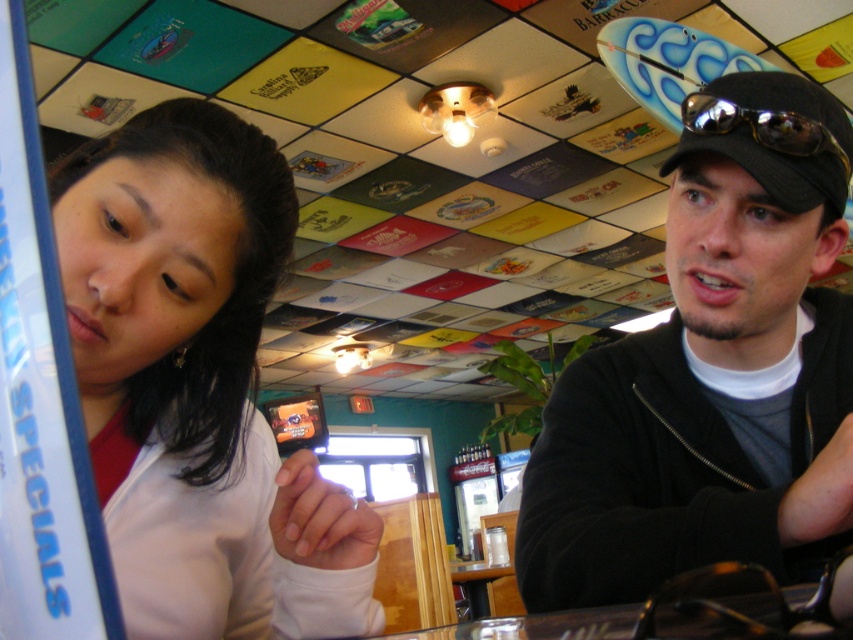
Question: Which point is farther from the camera taking this photo?

Choices:
 (A) (694, 100)
 (B) (782, 433)

Answer: (B)

Question: Does black matte jacket at upper right have a greater width compared to sunglassesmetallicgoggles at right?

Choices:
 (A) yes
 (B) no

Answer: (A)

Question: Among these points, which one is nearest to the camera?

Choices:
 (A) [778, 124]
 (B) [166, 326]

Answer: (B)

Question: Does black matte jacket at upper right appear on the right side of matte white shirt at left?

Choices:
 (A) yes
 (B) no

Answer: (A)

Question: Where is black matte jacket at upper right located in relation to matte white shirt at left in the image?

Choices:
 (A) above
 (B) below

Answer: (A)

Question: Which of the following is the farthest from the observer?

Choices:
 (A) sunglassesmetallicgoggles at right
 (B) black matte jacket at upper right

Answer: (A)